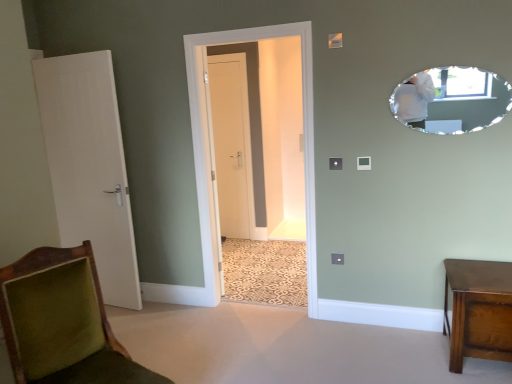
Question: Considering the relative positions of velvet green chair at lower left and shiny brown wooden side table at lower right in the image provided, is velvet green chair at lower left to the right of shiny brown wooden side table at lower right from the viewer's perspective?

Choices:
 (A) no
 (B) yes

Answer: (A)

Question: From a real-world perspective, is velvet green chair at lower left physically below shiny brown wooden side table at lower right?

Choices:
 (A) yes
 (B) no

Answer: (B)

Question: From the image's perspective, is velvet green chair at lower left below shiny brown wooden side table at lower right?

Choices:
 (A) no
 (B) yes

Answer: (B)

Question: Would you say velvet green chair at lower left is a long distance from shiny brown wooden side table at lower right?

Choices:
 (A) no
 (B) yes

Answer: (B)

Question: Is velvet green chair at lower left turned away from shiny brown wooden side table at lower right?

Choices:
 (A) no
 (B) yes

Answer: (A)

Question: Considering the positions of white matte door at center, the first door when ordered from back to front, and white wood door at left, the 2th door in the back-to-front sequence, in the image, is white matte door at center, the first door when ordered from back to front, taller or shorter than white wood door at left, the 2th door in the back-to-front sequence,?

Choices:
 (A) tall
 (B) short

Answer: (B)

Question: Does point coord(241,114) appear closer or farther from the camera than point coord(111,180)?

Choices:
 (A) farther
 (B) closer

Answer: (A)

Question: From the image's perspective, is white matte door at center, the 1th door when ordered from right to left, above or below white wood door at left, acting as the second door starting from the right?

Choices:
 (A) below
 (B) above

Answer: (B)

Question: Is white matte door at center, the 2th door in the front-to-back sequence, in front of or behind white wood door at left, which appears as the first door when viewed from the left, in the image?

Choices:
 (A) behind
 (B) front

Answer: (A)

Question: Is white wood door at left, the 2th door in the back-to-front sequence, in front of or behind clear glass door at center in the image?

Choices:
 (A) front
 (B) behind

Answer: (B)

Question: From the image's perspective, is white wood door at left, which appears as the first door when viewed from the left, positioned above or below clear glass door at center?

Choices:
 (A) above
 (B) below

Answer: (B)

Question: From a real-world perspective, is white wood door at left, which appears as the first door when viewed from the left, physically located above or below clear glass door at center?

Choices:
 (A) below
 (B) above

Answer: (A)

Question: Which is correct: white wood door at left, which appears as the first door when viewed from the left, is inside clear glass door at center, or outside of it?

Choices:
 (A) inside
 (B) outside

Answer: (B)

Question: Is point (105, 251) positioned closer to the camera than point (477, 269)?

Choices:
 (A) farther
 (B) closer

Answer: (A)

Question: In the image, is white wood door at left, the 2th door in the back-to-front sequence, positioned in front of or behind shiny brown wooden side table at lower right?

Choices:
 (A) front
 (B) behind

Answer: (B)